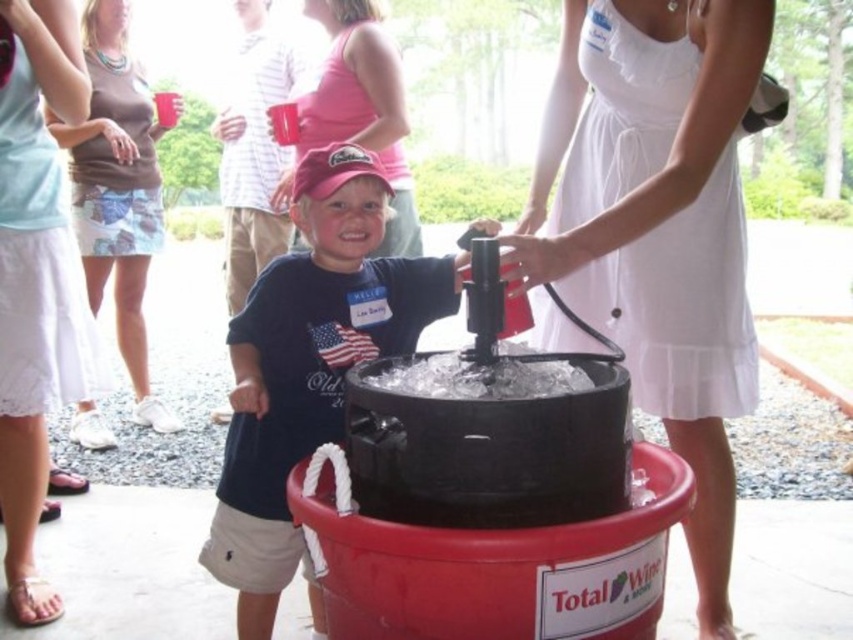
You are organizing a charity event and need to decide which clothing item to place in a donation bin. The bin has a size restriction that only allows items larger than a certain threshold. Given the scene, which item between the matte black shirt at center and the white lace dress at upper left should you choose?

The matte black shirt at center is bigger than the white lace dress at upper left, so you should choose the matte black shirt at center for the donation bin.

You are at a party and need to hand out drinks. There are two guests wearing matte black shirt at center and matte pink dress at center. Which guest should you approach first if you want to hand a drink to someone who is taller?

The matte black shirt at center is taller than the matte pink dress at center, so you should approach the guest wearing the matte black shirt at center first.

You are a photographer at the event and want to capture a photo that includes both the white cotton dress at center and the brown cotton tank top at upper left. Which clothing item should you focus on first to ensure both are in frame?

The white cotton dress at center is below the brown cotton tank top at upper left, so you should focus on the brown cotton tank top at upper left first to ensure both are in frame.